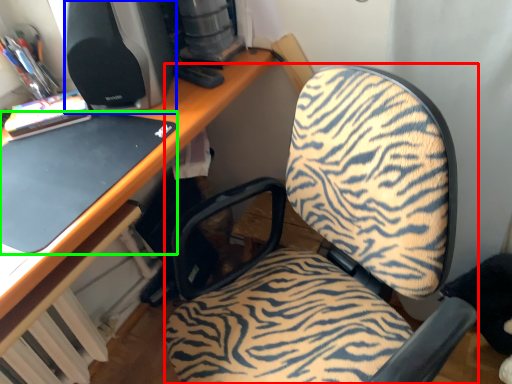
Question: Which is farther away from furniture (highlighted by a red box)? desktop computer (highlighted by a blue box) or laptop (highlighted by a green box)?

Choices:
 (A) desktop computer
 (B) laptop

Answer: (A)